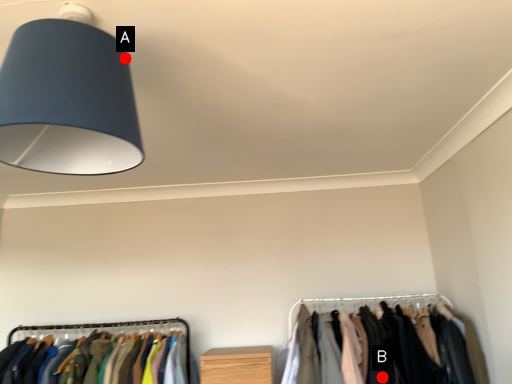
Question: Two points are circled on the image, labeled by A and B beside each circle. Among these points, which one is farthest from the camera?

Choices:
 (A) A is further
 (B) B is further

Answer: (B)